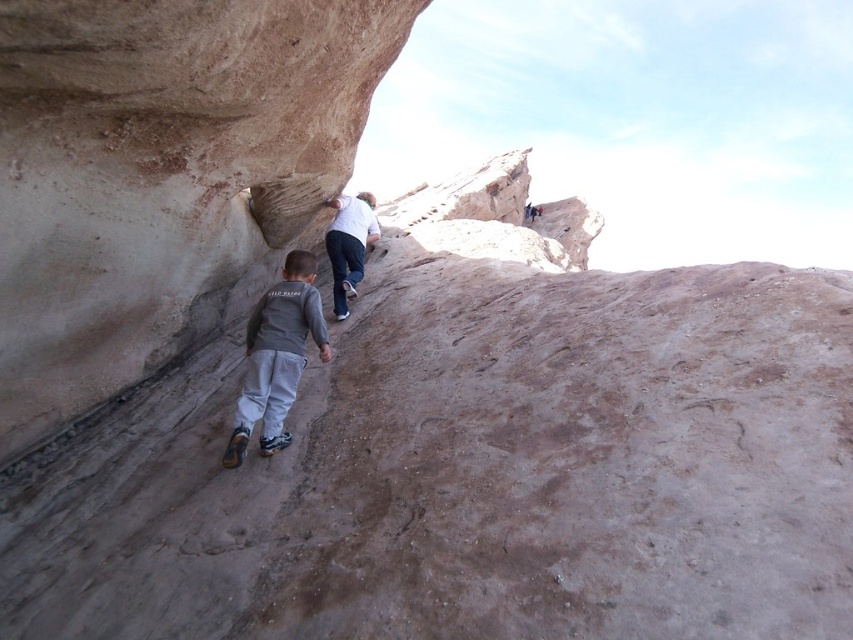
Does gray fabric pants at lower center have a greater height compared to white matte shirt at upper center?

Incorrect, gray fabric pants at lower center's height is not larger of white matte shirt at upper center's.

Describe the element at coordinates (277, 356) in the screenshot. I see `gray fabric pants at lower center` at that location.

Who is more distant from viewer, (282, 444) or (335, 252)?

The point (335, 252) is behind.

At what (x,y) coordinates should I click in order to perform the action: click on gray fabric pants at lower center. Please return your answer as a coordinate pair (x, y). The width and height of the screenshot is (853, 640). Looking at the image, I should click on (277, 356).

Is point (270, 253) in front of point (247, 433)?

No, it is behind (247, 433).

Looking at this image, is smooth beige rock at center to the right of gray fabric pants at lower center from the viewer's perspective?

Incorrect, smooth beige rock at center is not on the right side of gray fabric pants at lower center.

Between point (117, 268) and point (306, 317), which one is positioned in front?

Point (117, 268) is more forward.

This screenshot has width=853, height=640. I want to click on smooth beige rock at center, so click(161, 173).

Can you confirm if smooth beige rock at center is positioned to the left of white matte shirt at upper center?

Indeed, smooth beige rock at center is positioned on the left side of white matte shirt at upper center.

Is smooth beige rock at center further to the viewer compared to white matte shirt at upper center?

That is False.

Identify the location of smooth beige rock at center. (161, 173).

The width and height of the screenshot is (853, 640). What are the coordinates of `smooth beige rock at center` in the screenshot? It's located at (161, 173).